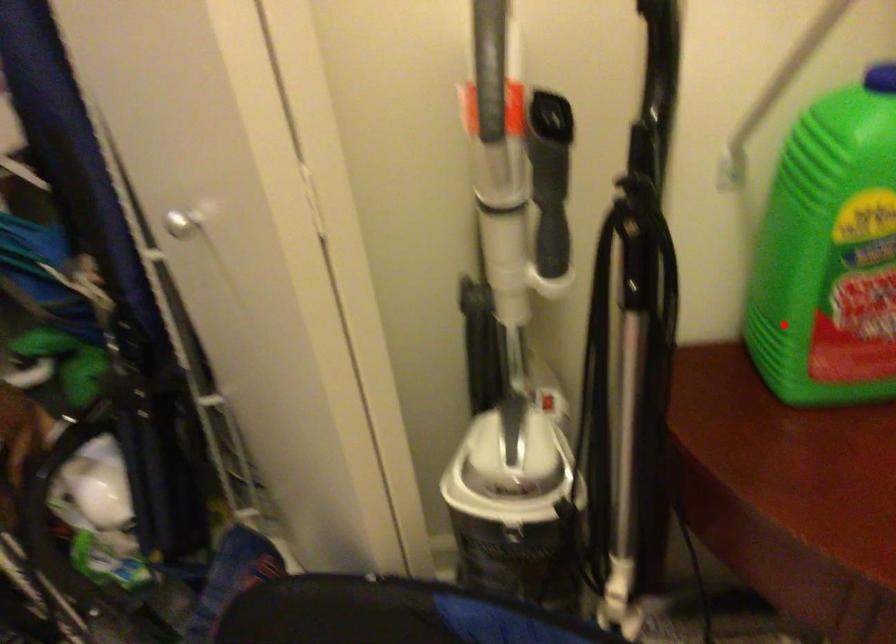
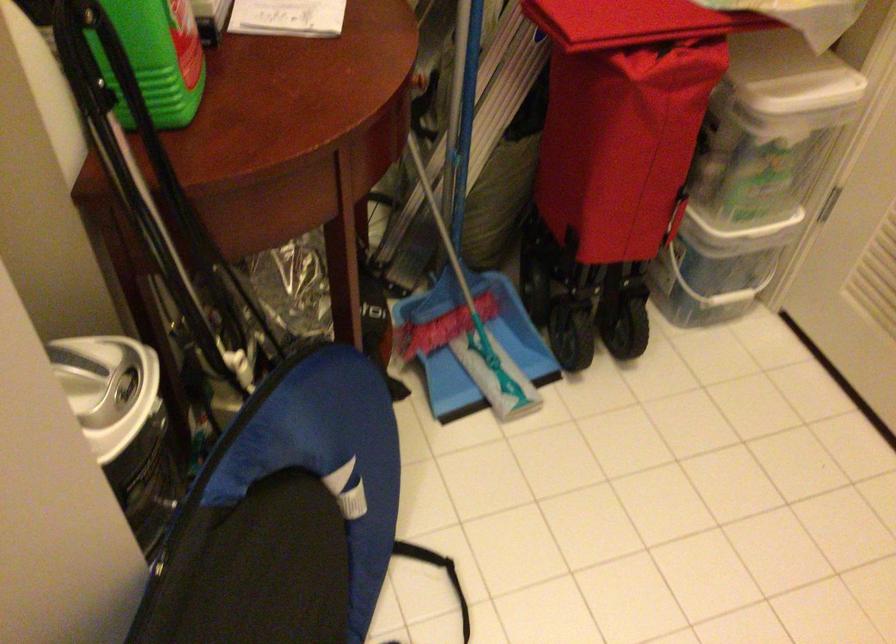
Question: I am providing you with two images of the same scene from different viewpoints. A red point is shown in image1. For the corresponding object point in image2, is it positioned nearer or farther from the camera?

Choices:
 (A) Nearer
 (B) Farther

Answer: (B)